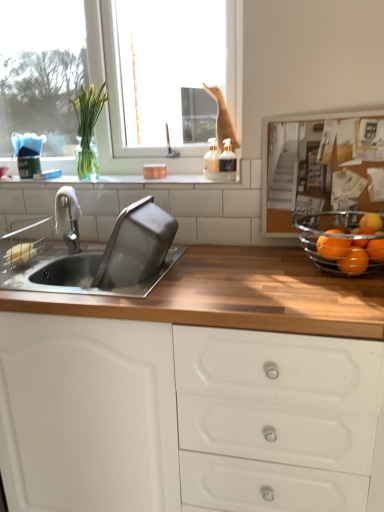
The width and height of the screenshot is (384, 512). What are the coordinates of `free space to the back side of orange matte/orange at right, which is the 3th orange in right-to-left order` in the screenshot? It's located at (298, 261).